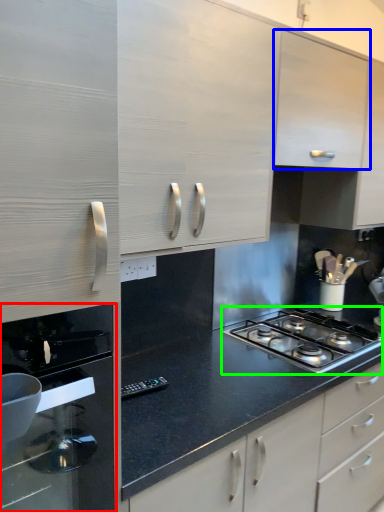
Question: Based on their relative distances, which object is farther from home appliance (highlighted by a red box)? Choose from cabinetry (highlighted by a blue box) and gas stove (highlighted by a green box).

Choices:
 (A) cabinetry
 (B) gas stove

Answer: (A)